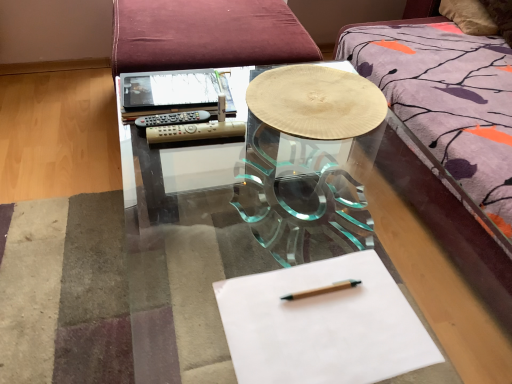
Measure the distance between point [340,125] and camera.

Point [340,125] and camera are 3.44 feet apart.

Where is `transparent glass table at center`? The image size is (512, 384). transparent glass table at center is located at coordinates (184, 253).

This screenshot has width=512, height=384. I want to click on wooden pencil at center, so click(322, 290).

Is wooden textured plate at center situated inside matte black notebook at upper left or outside?

wooden textured plate at center is not enclosed by matte black notebook at upper left.

Are wooden textured plate at center and matte black notebook at upper left far apart?

No, wooden textured plate at center is in close proximity to matte black notebook at upper left.

How many degrees apart are the facing directions of wooden textured plate at center and matte black notebook at upper left?

The facing directions of wooden textured plate at center and matte black notebook at upper left are 2.3 degrees apart.

Based on the photo, does wooden textured plate at center appear on the right side of matte black notebook at upper left?

Yes.

Is wooden pencil at center facing towards transparent glass table at center?

No, wooden pencil at center does not turn towards transparent glass table at center.

From a real-world perspective, is wooden pencil at center on top of transparent glass table at center?

Yes, from a real-world perspective, wooden pencil at center is over transparent glass table at center

Which object is positioned more to the right, wooden pencil at center or transparent glass table at center?

From the viewer's perspective, wooden pencil at center appears more on the right side.

From a real-world perspective, between matte black notebook at upper left and transparent glass table at center, who is vertically lower?

transparent glass table at center is physically lower.

Considering the sizes of objects matte black notebook at upper left and transparent glass table at center in the image provided, who is thinner, matte black notebook at upper left or transparent glass table at center?

matte black notebook at upper left.

From their relative heights in the image, would you say matte black notebook at upper left is taller or shorter than transparent glass table at center?

Clearly, matte black notebook at upper left is shorter compared to transparent glass table at center.

Looking at this image, from a real-world perspective, is transparent glass table at center positioned under wooden textured plate at center based on gravity?

Yes, from a real-world perspective, transparent glass table at center is under wooden textured plate at center.

Could you tell me if transparent glass table at center is turned towards wooden textured plate at center?

No, transparent glass table at center is not aimed at wooden textured plate at center.

In the scene shown: Is transparent glass table at center completely or partially outside of wooden textured plate at center?

Absolutely, transparent glass table at center is external to wooden textured plate at center.

Does white paper at center have a lesser height compared to wooden pencil at center?

Incorrect, the height of white paper at center does not fall short of that of wooden pencil at center.

Would you consider white paper at center to be distant from wooden pencil at center?

Actually, white paper at center and wooden pencil at center are a little close together.

Measure the distance from white paper at center to wooden pencil at center.

7.44 centimeters.

Is white paper at center positioned beyond the bounds of wooden pencil at center?

That's correct, white paper at center is outside of wooden pencil at center.

From the image's perspective, does wooden pencil at center appear lower than wooden textured plate at center?

Yes.

Does wooden pencil at center have a smaller size compared to wooden textured plate at center?

Correct, wooden pencil at center occupies less space than wooden textured plate at center.

Which object is wider, wooden pencil at center or wooden textured plate at center?

wooden textured plate at center is wider.

From the image's perspective, is matte black notebook at upper left located above or below wooden textured plate at center?

Clearly, from the image's perspective, matte black notebook at upper left is above wooden textured plate at center.

Which object is further away from the camera taking this photo, matte black notebook at upper left or wooden textured plate at center?

matte black notebook at upper left is behind.

From a real-world perspective, which object rests below the other?

wooden textured plate at center is physically lower.

In the scene shown: Between matte black notebook at upper left and wooden textured plate at center, which one has smaller width?

Thinner between the two is matte black notebook at upper left.

At what (x,y) coordinates should I click in order to perform the action: click on round table lying below the matte black notebook at upper left (from the image's perspective). Please return your answer as a coordinate pair (x, y). Looking at the image, I should click on (316, 102).

Where is `pencil in front of the transparent glass table at center`? pencil in front of the transparent glass table at center is located at coordinates (322, 290).

Which object lies further to the anchor point wooden textured plate at center, white paper at center or matte black notebook at upper left?

white paper at center.

Based on their spatial positions, is wooden textured plate at center or transparent glass table at center further from wooden pencil at center?

The object further to wooden pencil at center is transparent glass table at center.

When comparing their distances from white paper at center, does wooden textured plate at center or matte black notebook at upper left seem closer?

wooden textured plate at center is closer to white paper at center.

Based on the photo, when comparing their distances from matte black notebook at upper left, does wooden textured plate at center or transparent glass table at center seem further?

transparent glass table at center lies further to matte black notebook at upper left than the other object.

From the image, which object appears to be nearer to wooden pencil at center, white paper at center or matte black notebook at upper left?

white paper at center is closer to wooden pencil at center.

When comparing their distances from transparent glass table at center, does wooden pencil at center or wooden textured plate at center seem further?

wooden pencil at center lies further to transparent glass table at center than the other object.

When comparing their distances from wooden pencil at center, does white paper at center or wooden textured plate at center seem closer?

Among the two, white paper at center is located nearer to wooden pencil at center.

Based on their spatial positions, is matte black notebook at upper left or wooden pencil at center closer to white paper at center?

wooden pencil at center is closer to white paper at center.

The image size is (512, 384). Find the location of `round table that lies between matte black notebook at upper left and wooden pencil at center from top to bottom`. round table that lies between matte black notebook at upper left and wooden pencil at center from top to bottom is located at coordinates (316, 102).

Image resolution: width=512 pixels, height=384 pixels. I want to click on table between wooden textured plate at center and white paper at center in the vertical direction, so click(x=184, y=253).

In order to click on table between matte black notebook at upper left and wooden pencil at center in the up-down direction in this screenshot , I will do `click(184, 253)`.

Find the location of a particular element. The width and height of the screenshot is (512, 384). pencil between matte black notebook at upper left and white paper at center from top to bottom is located at coordinates (322, 290).